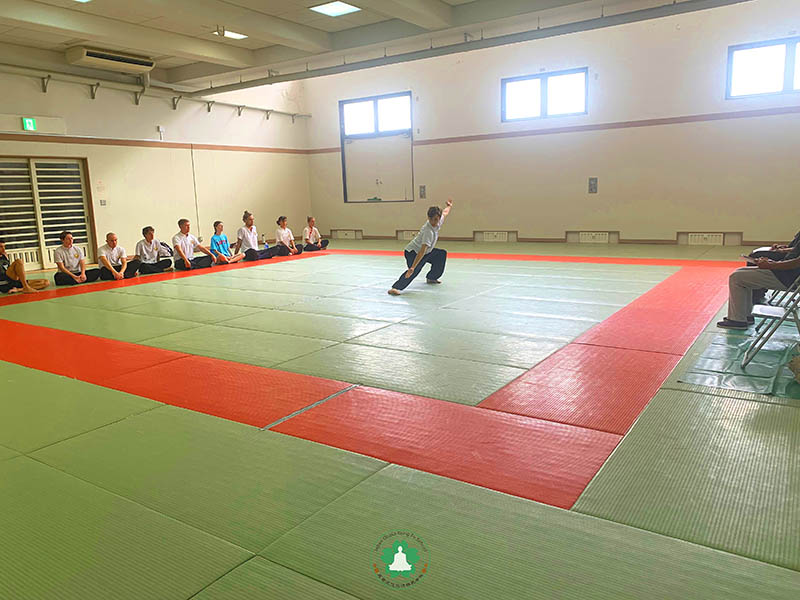
This screenshot has height=600, width=800. Find the location of `windows`. windows is located at coordinates (362, 114), (394, 114), (514, 104), (570, 89), (744, 80).